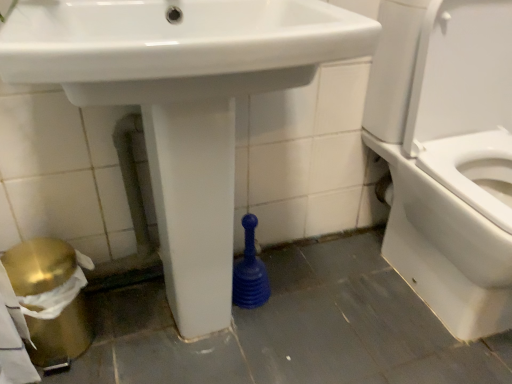
The image size is (512, 384). Identify the location of white glossy toilet at right. (448, 155).

Describe the element at coordinates (448, 155) in the screenshot. I see `white glossy toilet at right` at that location.

What do you see at coordinates (183, 103) in the screenshot?
I see `white glossy sink at center` at bounding box center [183, 103].

Image resolution: width=512 pixels, height=384 pixels. I want to click on white glossy sink at center, so click(183, 103).

Locate an element on the screen. The width and height of the screenshot is (512, 384). white glossy toilet at right is located at coordinates (448, 155).

Is white glossy sink at center at the left side of white glossy toilet at right?

Indeed, white glossy sink at center is positioned on the left side of white glossy toilet at right.

In the image, is white glossy sink at center positioned in front of or behind white glossy toilet at right?

In the image, white glossy sink at center appears in front of white glossy toilet at right.

Is point (222, 156) more distant than point (414, 277)?

No, it is in front of (414, 277).

From the image's perspective, which is below, white glossy sink at center or white glossy toilet at right?

white glossy sink at center.

Looking at this image, from a real-world perspective, is white glossy sink at center physically located above or below white glossy toilet at right?

white glossy sink at center is situated higher than white glossy toilet at right in the real world.

Considering the relative sizes of white glossy sink at center and white glossy toilet at right in the image provided, is white glossy sink at center wider than white glossy toilet at right?

No.

Does white glossy sink at center have a lesser height compared to white glossy toilet at right?

In fact, white glossy sink at center may be taller than white glossy toilet at right.

Looking at the image, does white glossy sink at center seem bigger or smaller compared to white glossy toilet at right?

white glossy sink at center is bigger than white glossy toilet at right.

Based on the photo, is white glossy sink at center inside the boundaries of white glossy toilet at right, or outside?

white glossy sink at center is not inside white glossy toilet at right, it's outside.

Is white glossy sink at center positioned far away from white glossy toilet at right?

Actually, white glossy sink at center and white glossy toilet at right are a little close together.

Is white glossy sink at center oriented away from white glossy toilet at right?

No, white glossy toilet at right is not at the back of white glossy sink at center.

How many degrees apart are the facing directions of white glossy sink at center and white glossy toilet at right?

There is a 1.31-degree angle between the facing directions of white glossy sink at center and white glossy toilet at right.

Locate an element on the screen. The height and width of the screenshot is (384, 512). toilet that is on the right side of white glossy sink at center is located at coordinates (448, 155).

Based on the photo, which object is positioned more to the left, white glossy toilet at right or white glossy sink at center?

white glossy sink at center.

In the scene shown: Is white glossy toilet at right in front of or behind white glossy sink at center in the image?

Clearly, white glossy toilet at right is behind white glossy sink at center.

Which is behind, point (449, 124) or point (128, 40)?

The point (449, 124) is more distant.

From the image's perspective, which is above, white glossy toilet at right or white glossy sink at center?

white glossy toilet at right appears higher in the image.

From a real-world perspective, is white glossy toilet at right above or below white glossy sink at center?

In terms of real-world spatial position, white glossy toilet at right is below white glossy sink at center.

Considering the relative sizes of white glossy toilet at right and white glossy sink at center in the image provided, is white glossy toilet at right thinner than white glossy sink at center?

No.

Who is taller, white glossy toilet at right or white glossy sink at center?

white glossy sink at center.

Can you confirm if white glossy toilet at right is bigger than white glossy sink at center?

Actually, white glossy toilet at right might be smaller than white glossy sink at center.

Do you think white glossy toilet at right is within white glossy sink at center, or outside of it?

white glossy toilet at right lies outside white glossy sink at center.

Is white glossy toilet at right with white glossy sink at center?

No, white glossy toilet at right is not touching white glossy sink at center.

Is white glossy toilet at right oriented away from white glossy sink at center?

No.

Looking at this image, can you tell me how much white glossy toilet at right and white glossy sink at center differ in facing direction?

There is a 1.31-degree angle between the facing directions of white glossy toilet at right and white glossy sink at center.

This screenshot has height=384, width=512. Find the location of `toilet located behind the white glossy sink at center`. toilet located behind the white glossy sink at center is located at coordinates (448, 155).

Identify the location of sink below the white glossy toilet at right (from the image's perspective). This screenshot has height=384, width=512. (183, 103).

Where is `sink in front of the white glossy toilet at right`? Image resolution: width=512 pixels, height=384 pixels. sink in front of the white glossy toilet at right is located at coordinates (183, 103).